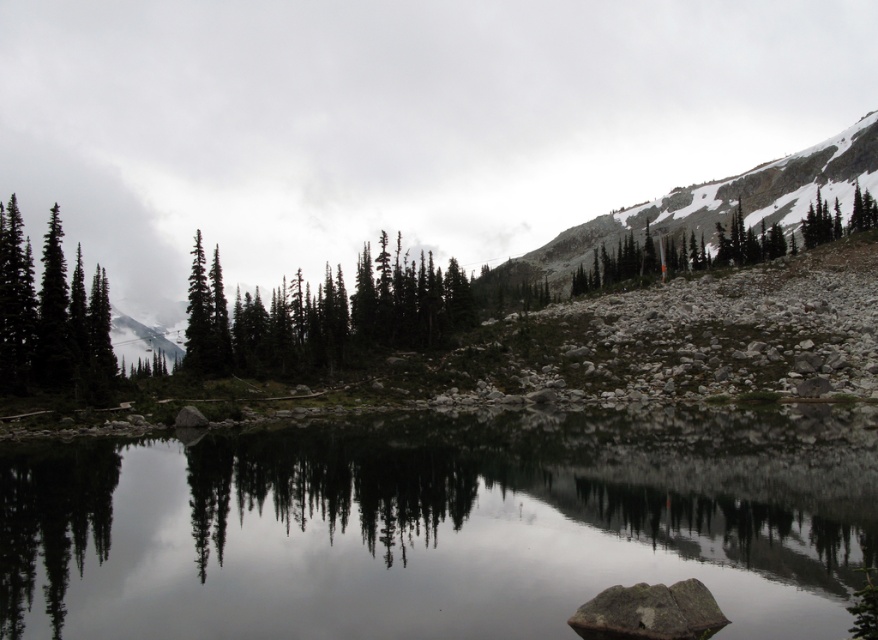
Who is positioned more to the left, smooth reflective water at center or rocky gray mountain at upper right?

smooth reflective water at center

Is point (507, 476) farther from camera compared to point (644, 209)?

No, it is in front of (644, 209).

Find the location of `smooth reflective water at center`. smooth reflective water at center is located at coordinates (436, 525).

Measure the distance between smooth reflective water at center and camera.

smooth reflective water at center is 18.06 meters away from camera.

From the picture: Between smooth reflective water at center and green matte evergreen trees at left, which one has less height?

Standing shorter between the two is smooth reflective water at center.

Is point (645, 531) behind point (92, 332)?

No.

Locate an element on the screen. The width and height of the screenshot is (878, 640). smooth reflective water at center is located at coordinates (436, 525).

Is green matte trees at center positioned behind rocky gray mountain at upper right?

No, green matte trees at center is closer to the viewer.

Is point (339, 339) positioned behind point (693, 225)?

No, it is not.

Is point (360, 317) more distant than point (543, 264)?

No, (360, 317) is closer to viewer.

What are the coordinates of `green matte trees at center` in the screenshot? It's located at (322, 316).